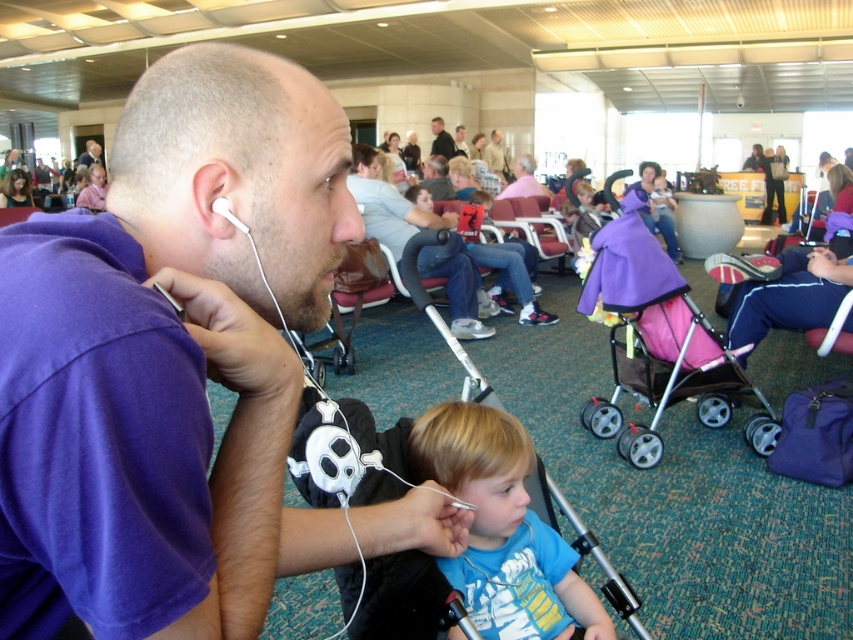
Which is above, purple fabric shirt at upper left or purple fabric shirt at left?

Positioned higher is purple fabric shirt at left.

Is purple fabric shirt at upper left taller than purple fabric shirt at left?

Yes, purple fabric shirt at upper left is taller than purple fabric shirt at left.

Describe the element at coordinates (93, 189) in the screenshot. The image size is (853, 640). I see `purple fabric shirt at upper left` at that location.

Identify the location of purple fabric shirt at upper left. (93, 189).

Looking at this image, is blue cotton shirt at center to the right of light brown leather jacket at center from the viewer's perspective?

In fact, blue cotton shirt at center is to the left of light brown leather jacket at center.

Which is more to the right, blue cotton shirt at center or light brown leather jacket at center?

light brown leather jacket at center is more to the right.

I want to click on blue cotton shirt at center, so click(x=502, y=529).

You are a GUI agent. You are given a task and a screenshot of the screen. Output one action in this format:
    pyautogui.click(x=<x>, y=<y>)
    Task: Click on the blue cotton shirt at center
    This screenshot has height=640, width=853.
    Given the screenshot: What is the action you would take?
    pyautogui.click(x=502, y=529)

Does blue cotton shirt at center have a smaller size compared to dark gray suit at center?

Correct, blue cotton shirt at center occupies less space than dark gray suit at center.

Between point (492, 536) and point (438, 144), which one is positioned behind?

The point (438, 144) is more distant.

The width and height of the screenshot is (853, 640). What do you see at coordinates (502, 529) in the screenshot? I see `blue cotton shirt at center` at bounding box center [502, 529].

This screenshot has width=853, height=640. I want to click on blue cotton shirt at center, so click(x=502, y=529).